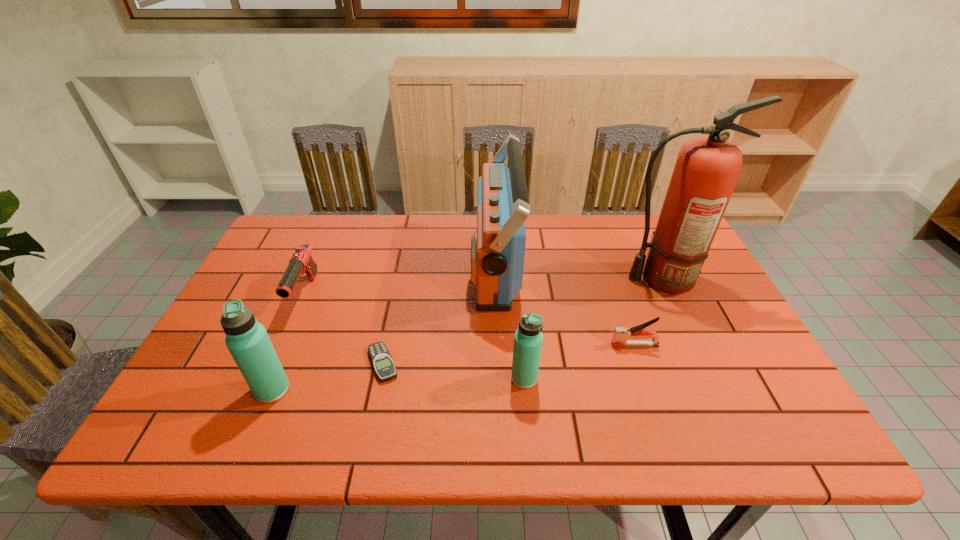
The width and height of the screenshot is (960, 540). In order to click on vacant space at the near edge in this screenshot , I will do `click(433, 395)`.

Locate an element on the screen. This screenshot has height=540, width=960. vacant area at the right edge of the desktop is located at coordinates (742, 362).

Identify the location of free space at the near right corner of the desktop. 750,403.

At what (x,y) coordinates should I click in order to perform the action: click on vacant region between the fire extinguisher and the fifth shortest object. Please return your answer as a coordinate pair (x, y). Looking at the image, I should click on (467, 334).

This screenshot has height=540, width=960. Find the location of `free space between the gun and the shortest object`. free space between the gun and the shortest object is located at coordinates (345, 329).

You are a GUI agent. You are given a task and a screenshot of the screen. Output one action in this format:
    pyautogui.click(x=<x>, y=<y>)
    Task: Click on the vacant region between the gun and the sixth tallest object
    
    Given the screenshot: What is the action you would take?
    pyautogui.click(x=470, y=320)

Find the location of a particular element. Image resolution: width=960 pixels, height=540 pixels. blank region between the sixth tallest object and the left thermos bottle is located at coordinates (453, 367).

What are the coordinates of `vacant space that's between the fifth tallest object and the stapler` in the screenshot? It's located at (470, 320).

Identify the location of vacant area that lies between the radio receiver and the fifth tallest object. (400, 281).

Locate an element on the screen. free space between the fifth tallest object and the stapler is located at coordinates (470, 320).